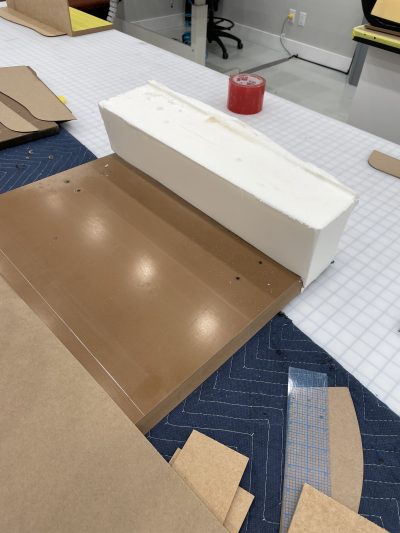
The width and height of the screenshot is (400, 533). In order to click on table with grid pattern in this screenshot , I will do `click(367, 280)`, `click(299, 121)`.